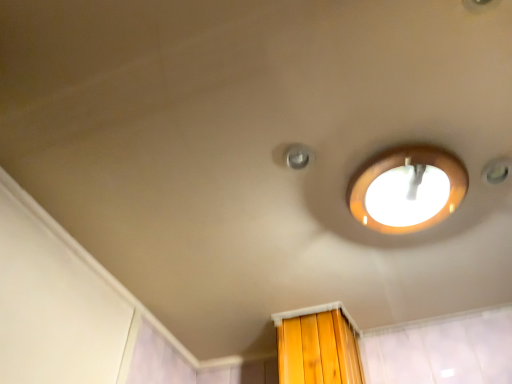
What is the approximate width of matte white lamp at upper center?

matte white lamp at upper center is 12.11 inches wide.

The height and width of the screenshot is (384, 512). Describe the element at coordinates (407, 188) in the screenshot. I see `matte white lamp at upper center` at that location.

This screenshot has height=384, width=512. In order to click on matte white lamp at upper center in this screenshot , I will do `click(407, 188)`.

Locate an element on the screen. matte white lamp at upper center is located at coordinates (407, 188).